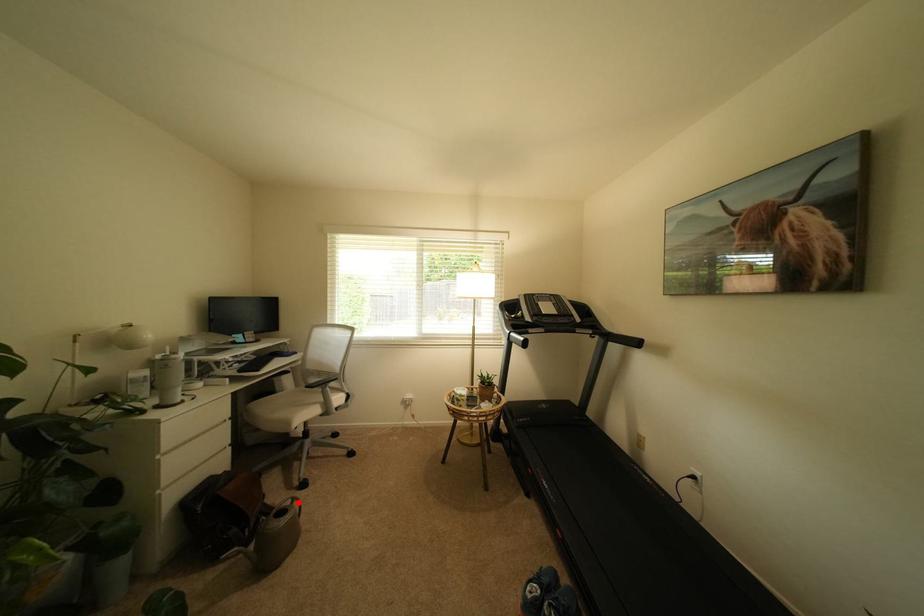
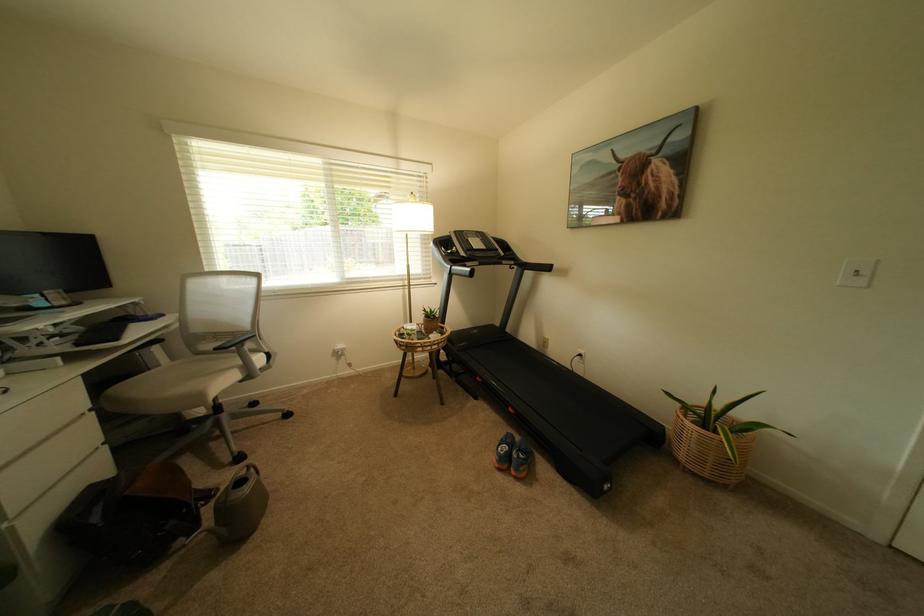
Question: A red point is marked in image1. In image2, is the corresponding 3D point closer to the camera or farther? Reply with the corresponding letter.

Choices:
 (A) The corresponding 3D point is closer.
 (B) The corresponding 3D point is farther.

Answer: (B)